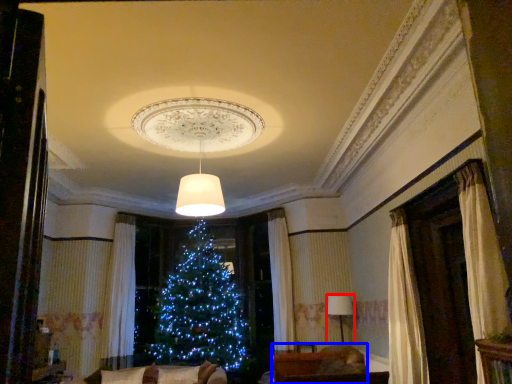
Question: Which object is closer to the camera taking this photo, lamp (highlighted by a red box) or furniture (highlighted by a blue box)?

Choices:
 (A) lamp
 (B) furniture

Answer: (B)